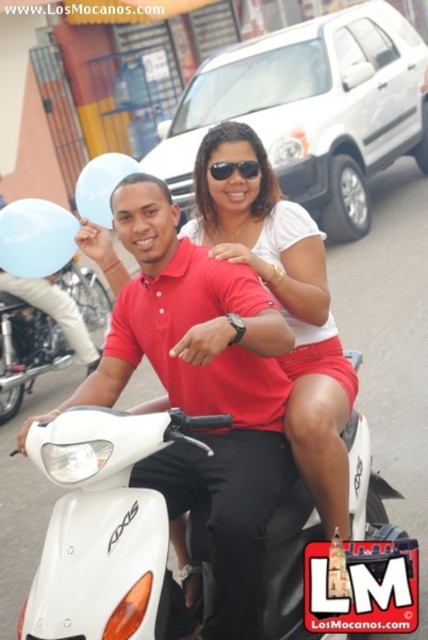
Question: Can you confirm if transparent blue balloon at upper left is bigger than black plastic sunglasses at center?

Choices:
 (A) yes
 (B) no

Answer: (A)

Question: Which object appears closest to the camera in this image?

Choices:
 (A) transparent blue balloon at upper left
 (B) black plastic sunglasses at center

Answer: (B)

Question: Considering the real-world distances, which object is closest to the white glossy motorcycle at left?

Choices:
 (A) white glossy scooter at center
 (B) black plastic sunglasses at center
 (C) matte red polo shirt at center

Answer: (B)

Question: Is light blue rubber balloon at upper left positioned at the back of transparent blue balloon at upper left?

Choices:
 (A) yes
 (B) no

Answer: (B)

Question: Which object is farther from the camera taking this photo?

Choices:
 (A) transparent blue balloon at upper left
 (B) white matte skirt at center

Answer: (A)

Question: Can you confirm if transparent blue balloon at upper left is wider than black plastic sunglasses at center?

Choices:
 (A) yes
 (B) no

Answer: (A)